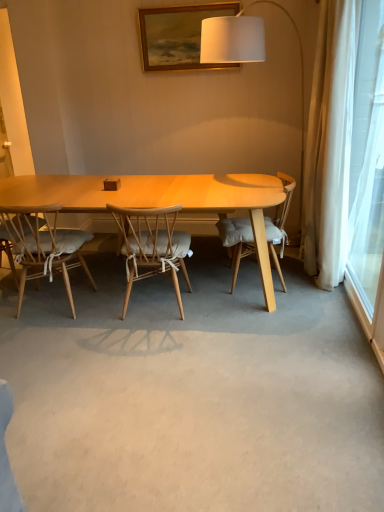
This screenshot has width=384, height=512. In order to click on vacant space situated on the left part of natural wood chair with cushion at center, which is the 2th chair from right to left in this screenshot , I will do `click(93, 312)`.